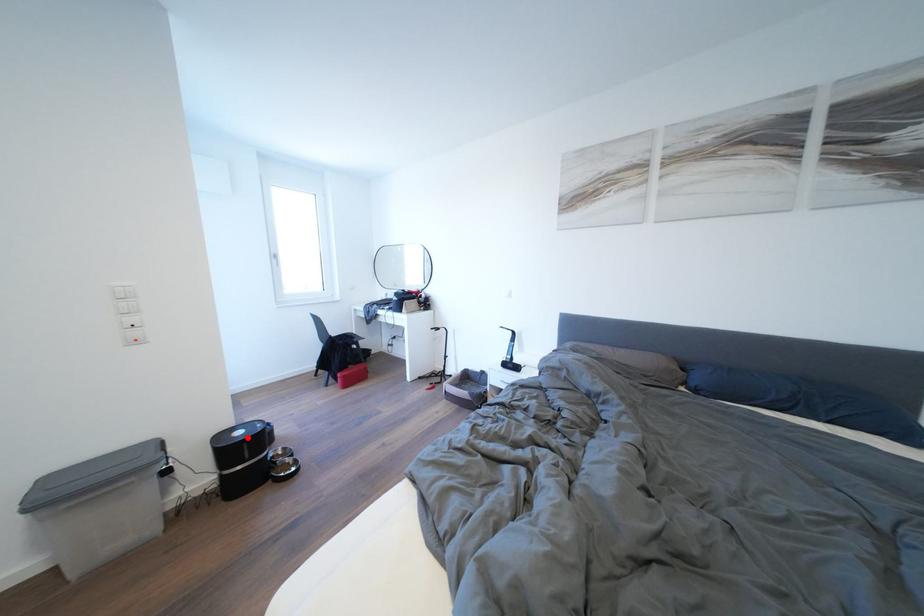
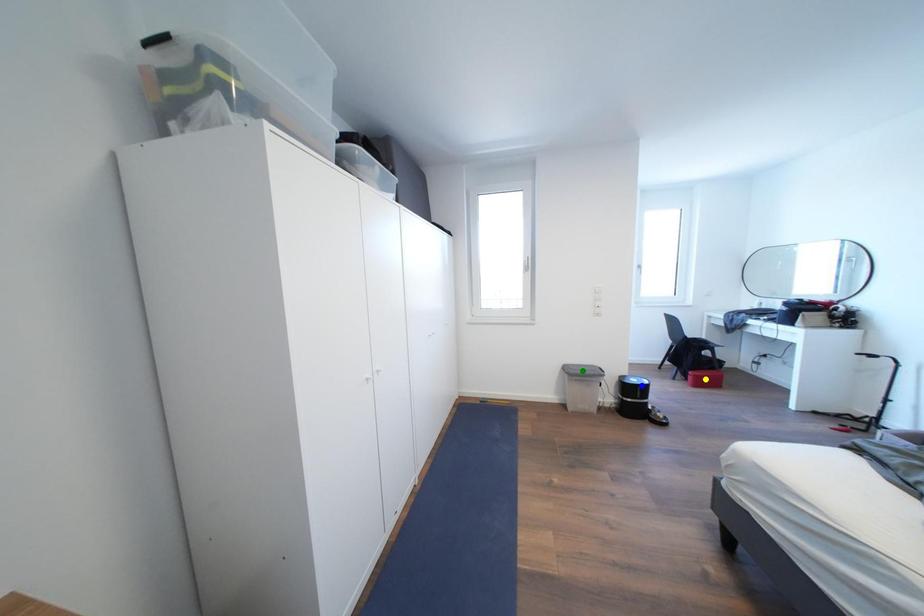
Question: I am providing you with two images of the same scene from different viewpoints. A red point is marked on the first image. You are given multiple points on the second image. Which spot in image 2 lines up with the point in image 1?

Choices:
 (A) blue point
 (B) yellow point
 (C) green point

Answer: (A)